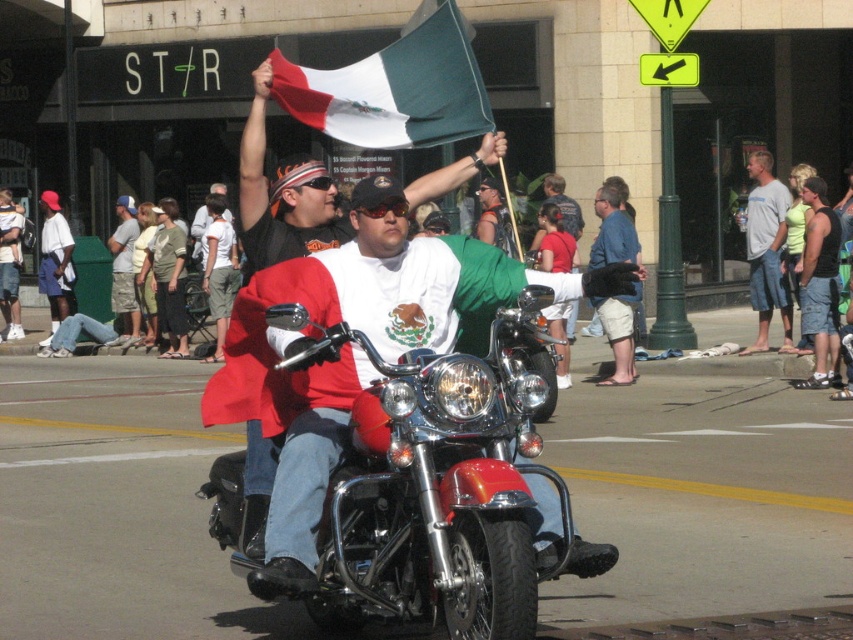
You are a photographer trying to capture the matte black motorcycle at center and the green felt flag at upper center in a single frame. Based on their positions, which object should you adjust your camera to focus on first to ensure both are in the shot?

The green felt flag at upper center is to the right of the matte black motorcycle at center, so you should focus on the matte black motorcycle at center first to ensure both are in the shot.